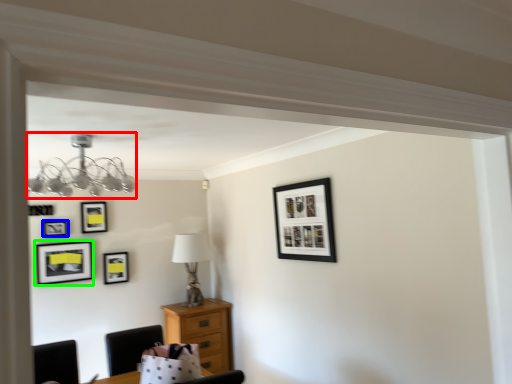
Question: Estimate the real-world distances between objects in this image. Which object is closer to lamp (highlighted by a red box), picture frame (highlighted by a blue box) or picture frame (highlighted by a green box)?

Choices:
 (A) picture frame
 (B) picture frame

Answer: (B)